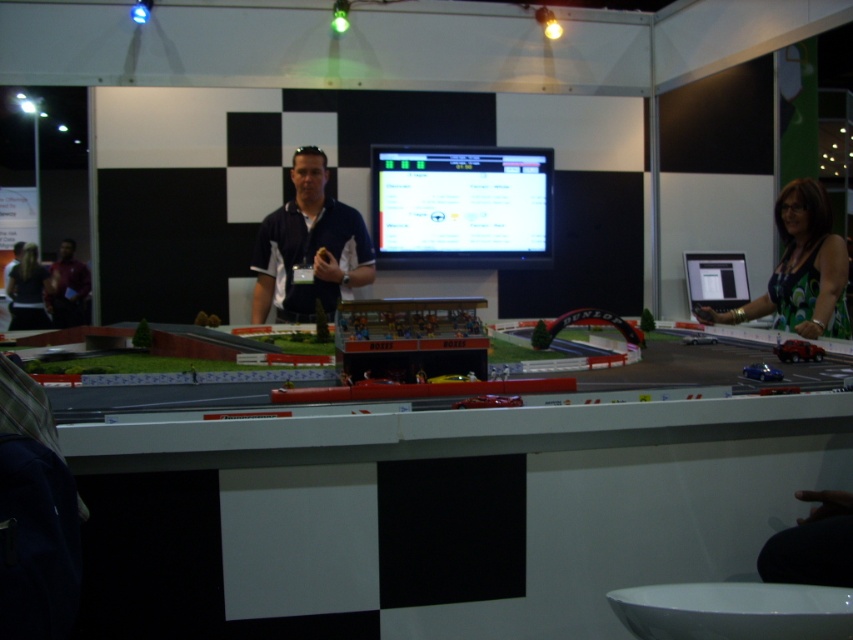
You are standing in front of the model race track at the exhibition. You notice two points marked on the track. The first point is at coordinates point (299, 264) and the second is at point (33, 269). Which of these points is closer to you?

Point (299, 264) is closer to the camera than point (33, 269), so the first point is closer to you.

You are a photographer at the exhibition and need to capture a photo of both the green floral dress at right and the dark gray shirt at left in the same frame. Given that your camera has a maximum focal length that allows capturing objects up to 20 feet apart, will you be able to include both subjects in your shot?

The green floral dress at right is 20.26 feet from the dark gray shirt at left. Since the distance exceeds the camera maximum focal length of 20 feet, you won t be able to capture both subjects in the same frame.

You are at a trade show and see two people in the scene. One is wearing a matte blue shirt at center and the other a dark gray shirt at left. From the perspective of someone standing in front of the track, which shirt is on the left?

The dark gray shirt at left is on the left side.